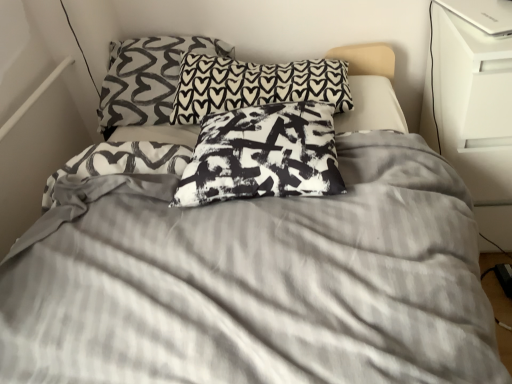
Question: Can you confirm if black printed pillow at upper center, acting as the second pillow starting from the front, is positioned to the left of black printed pillow at upper center, which appears as the 3th pillow when viewed from the front?

Choices:
 (A) no
 (B) yes

Answer: (A)

Question: Does black printed pillow at upper center, acting as the second pillow starting from the front, have a greater width compared to black printed pillow at upper center, which appears as the 3th pillow when viewed from the front?

Choices:
 (A) no
 (B) yes

Answer: (B)

Question: Considering the relative positions of black printed pillow at upper center, acting as the second pillow starting from the front, and black printed pillow at upper center, which appears as the 3th pillow when viewed from the front, in the image provided, is black printed pillow at upper center, acting as the second pillow starting from the front, behind black printed pillow at upper center, which appears as the 3th pillow when viewed from the front,?

Choices:
 (A) no
 (B) yes

Answer: (A)

Question: Could you tell me if black printed pillow at upper center, acting as the second pillow starting from the front, is facing black printed pillow at upper center, which appears as the first pillow when viewed from the back?

Choices:
 (A) yes
 (B) no

Answer: (B)

Question: From the image's perspective, is black printed pillow at upper center, acting as the 2th pillow starting from the back, below black printed pillow at upper center, which appears as the first pillow when viewed from the back?

Choices:
 (A) no
 (B) yes

Answer: (B)

Question: Is black printed pillow at upper center, acting as the second pillow starting from the front, not close to black printed pillow at upper center, which appears as the first pillow when viewed from the back?

Choices:
 (A) no
 (B) yes

Answer: (A)

Question: Is black printed pillow at upper center, which appears as the 3th pillow when viewed from the front, bigger than black printed pillow at center, the 3th pillow positioned from the back?

Choices:
 (A) no
 (B) yes

Answer: (B)

Question: Is black printed pillow at upper center, which appears as the 3th pillow when viewed from the front, taller than black printed pillow at center, the first pillow in the front-to-back sequence?

Choices:
 (A) no
 (B) yes

Answer: (B)

Question: Could you tell me if black printed pillow at upper center, which appears as the 3th pillow when viewed from the front, is facing black printed pillow at center, the 3th pillow positioned from the back?

Choices:
 (A) no
 (B) yes

Answer: (A)

Question: Can you confirm if black printed pillow at upper center, which appears as the first pillow when viewed from the back, is wider than black printed pillow at center, the 3th pillow positioned from the back?

Choices:
 (A) yes
 (B) no

Answer: (A)

Question: Is black printed pillow at upper center, which appears as the first pillow when viewed from the back, next to black printed pillow at center, the first pillow in the front-to-back sequence, and touching it?

Choices:
 (A) no
 (B) yes

Answer: (A)

Question: Considering the relative positions of black printed pillow at upper center, which appears as the first pillow when viewed from the back, and black printed pillow at center, the first pillow in the front-to-back sequence, in the image provided, is black printed pillow at upper center, which appears as the first pillow when viewed from the back, to the right of black printed pillow at center, the first pillow in the front-to-back sequence, from the viewer's perspective?

Choices:
 (A) no
 (B) yes

Answer: (A)

Question: From the image's perspective, would you say black printed pillow at upper center, which appears as the 3th pillow when viewed from the front, is shown under white glossy dresser at right?

Choices:
 (A) yes
 (B) no

Answer: (B)